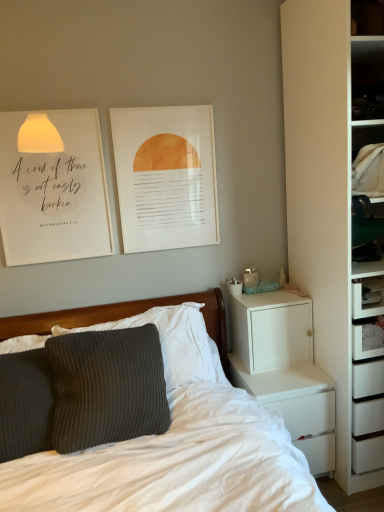
Question: From a real-world perspective, is white matte chest of drawers at right above or below white paper at upper left?

Choices:
 (A) below
 (B) above

Answer: (A)

Question: Based on their sizes in the image, would you say white matte chest of drawers at right is bigger or smaller than white paper at upper left?

Choices:
 (A) small
 (B) big

Answer: (B)

Question: Considering the real-world distances, which object is farthest from the matte paper picture frame at upper center?

Choices:
 (A) white paper at upper left
 (B) dark grey textured pillow at left
 (C) white matte chest of drawers at right
 (D) white matte cabinet at right

Answer: (B)

Question: Which is nearer to the matte paper picture frame at upper center?

Choices:
 (A) dark grey textured pillow at left
 (B) white matte cabinet at right
 (C) white paper at upper left
 (D) white matte chest of drawers at right

Answer: (C)